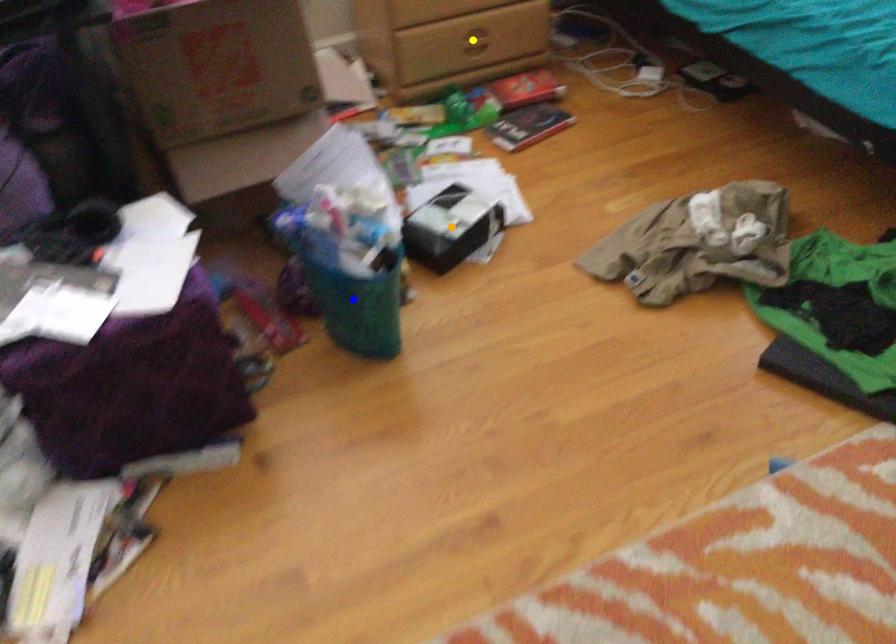
Order these from farthest to nearest:
1. yellow point
2. blue point
3. orange point

yellow point, orange point, blue point